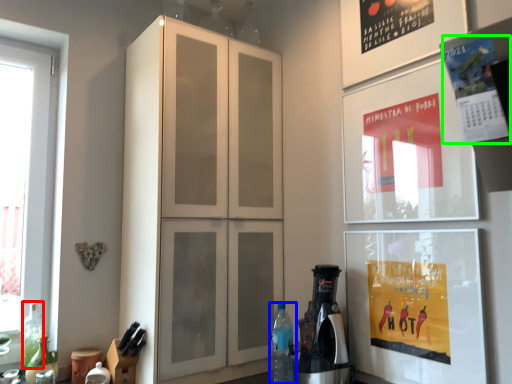
Question: Based on their relative distances, which object is nearer to bottle (highlighted by a red box)? Choose from bottle (highlighted by a blue box) and poster (highlighted by a green box).

Choices:
 (A) bottle
 (B) poster

Answer: (A)